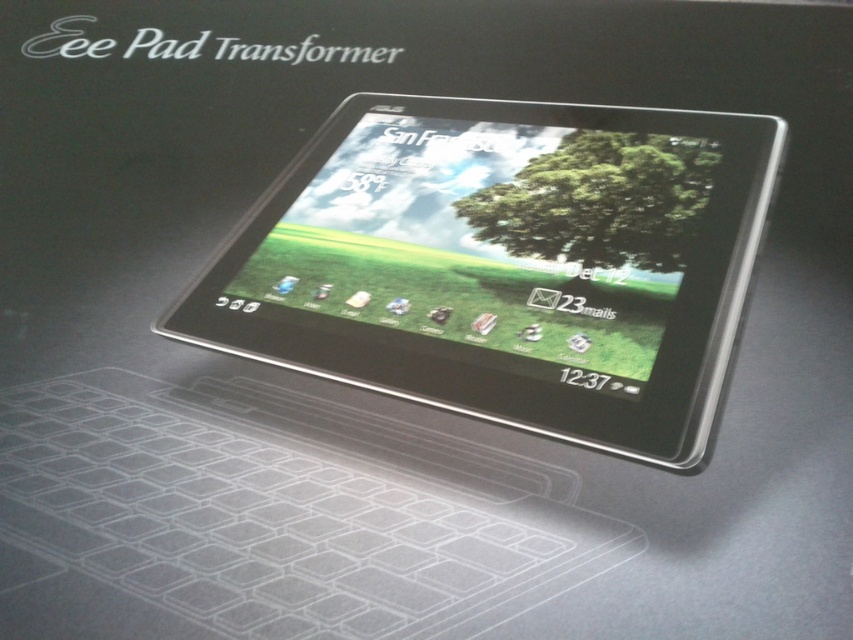
Question: Does satin black tablet at center appear on the right side of green matte tree at center?

Choices:
 (A) no
 (B) yes

Answer: (A)

Question: Which point is farther from the camera taking this photo?

Choices:
 (A) (326, 257)
 (B) (631, 227)

Answer: (A)

Question: Which object is closer to the camera taking this photo?

Choices:
 (A) satin black tablet at center
 (B) green matte tree at center

Answer: (A)

Question: Which object appears farthest from the camera in this image?

Choices:
 (A) green matte tree at center
 (B) satin black tablet at center

Answer: (A)

Question: Is satin black tablet at center bigger than green matte tree at center?

Choices:
 (A) no
 (B) yes

Answer: (B)

Question: Does satin black tablet at center appear under green matte tree at center?

Choices:
 (A) yes
 (B) no

Answer: (A)